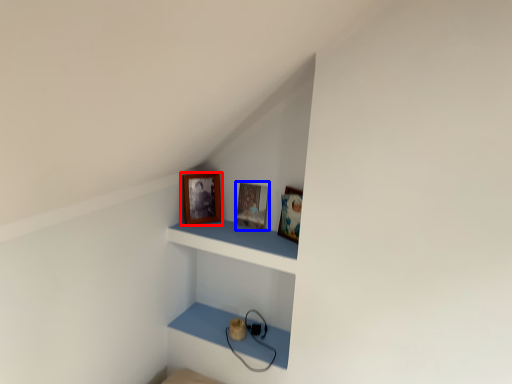
Question: Which point is further to the camera, picture frame (highlighted by a red box) or picture frame (highlighted by a blue box)?

Choices:
 (A) picture frame
 (B) picture frame

Answer: (B)